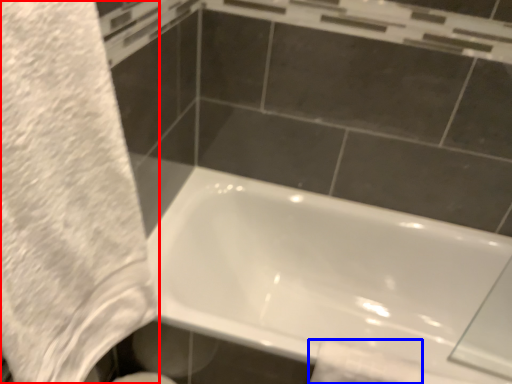
Question: Which point is closer to the camera, bath towel (highlighted by a red box) or toilet paper (highlighted by a blue box)?

Choices:
 (A) bath towel
 (B) toilet paper

Answer: (A)